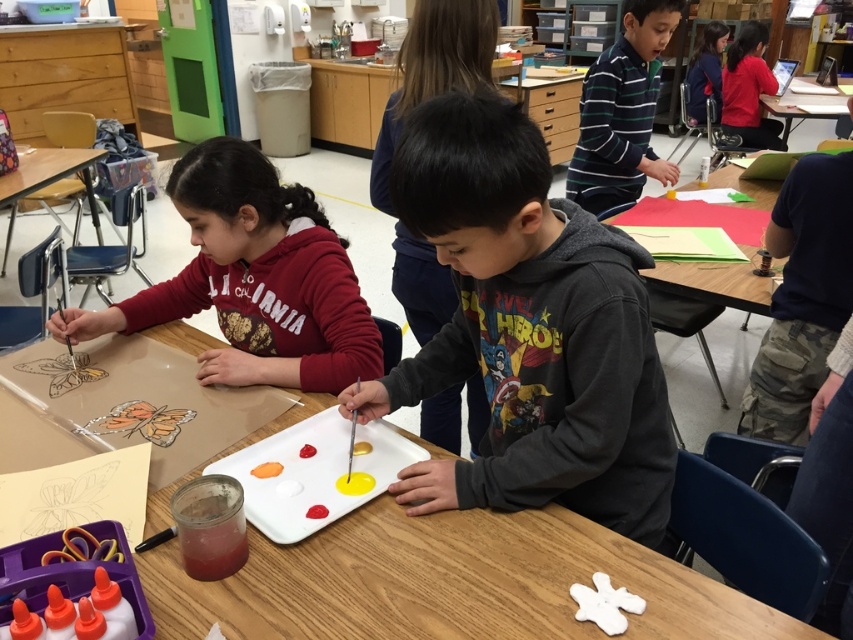
Question: Does gray fleece hoodie at center have a smaller size compared to yellow matte paint brush at center?

Choices:
 (A) yes
 (B) no

Answer: (B)

Question: Considering the real-world distances, which object is closest to the yellow matte paint brush at center?

Choices:
 (A) wooden table at center
 (B) matte red hoodie at upper center
 (C) dark blue hoodie at upper right

Answer: (A)

Question: Which is farther from the matte red hoodie at upper center?

Choices:
 (A) dark gray hoodie at center
 (B) dark blue hoodie at upper right

Answer: (A)

Question: From the image, what is the correct spatial relationship of striped cotton shirt at upper right in relation to wooden table at upper center?

Choices:
 (A) above
 (B) below

Answer: (B)

Question: Which object is the closest to the wooden table at upper center?

Choices:
 (A) dark gray hoodie at center
 (B) wooden table at center

Answer: (A)

Question: In this image, where is matte red hoodie at upper center located relative to wooden table at left?

Choices:
 (A) right
 (B) left

Answer: (A)